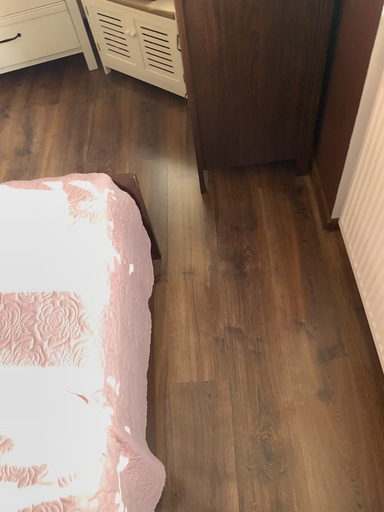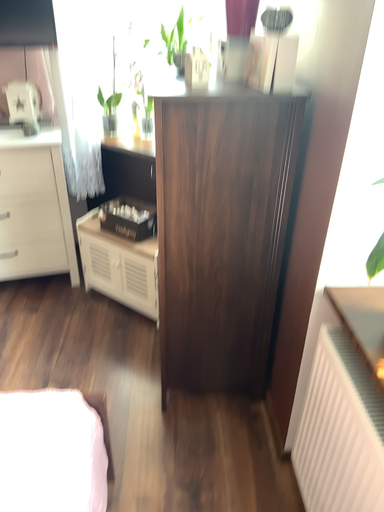
Question: How did the camera likely rotate when shooting the video?

Choices:
 (A) rotated upward
 (B) rotated downward

Answer: (A)